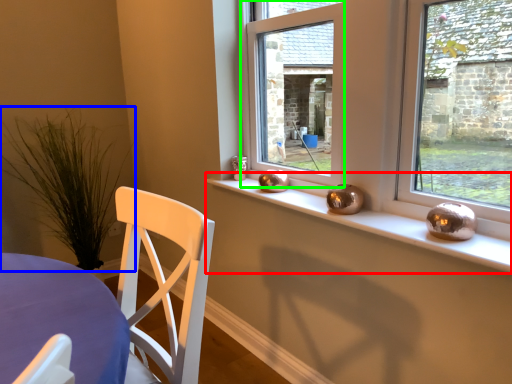
Question: Considering the real-world distances, which object is closest to window sill (highlighted by a red box)? plant (highlighted by a blue box) or window (highlighted by a green box).

Choices:
 (A) plant
 (B) window

Answer: (B)